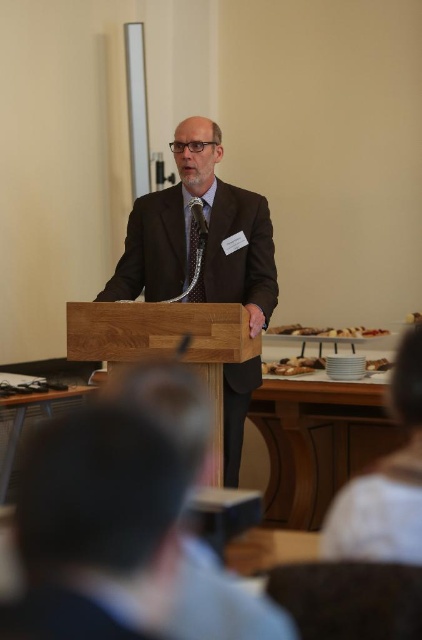
Between white fabric at lower right and white glossy plate at lower center, which one has less height?

white glossy plate at lower center is shorter.

Which is in front, point (414, 470) or point (297, 332)?

Point (414, 470)

Does point (403, 403) lie behind point (352, 326)?

That is False.

Find the location of a particular element. Image resolution: width=422 pixels, height=640 pixels. white fabric at lower right is located at coordinates (386, 481).

Is the position of wooden podium at center less distant than that of brown crumbly pastry at center?

Yes, it is.

Between wooden podium at center and brown crumbly pastry at center, which one is positioned higher?

wooden podium at center is above.

Based on the photo, who is more distant from viewer, (132, 352) or (367, 369)?

The point (367, 369) is more distant.

This screenshot has width=422, height=640. Identify the location of wooden podium at center. (165, 342).

Can you confirm if white fabric at lower right is positioned to the right of brown crumbly pastry at center?

Incorrect, white fabric at lower right is not on the right side of brown crumbly pastry at center.

Does white fabric at lower right have a smaller size compared to brown crumbly pastry at center?

No, white fabric at lower right is not smaller than brown crumbly pastry at center.

Which is behind, point (397, 394) or point (386, 365)?

Positioned behind is point (386, 365).

Find the location of a particular element. Image resolution: width=422 pixels, height=640 pixels. white fabric at lower right is located at coordinates (386, 481).